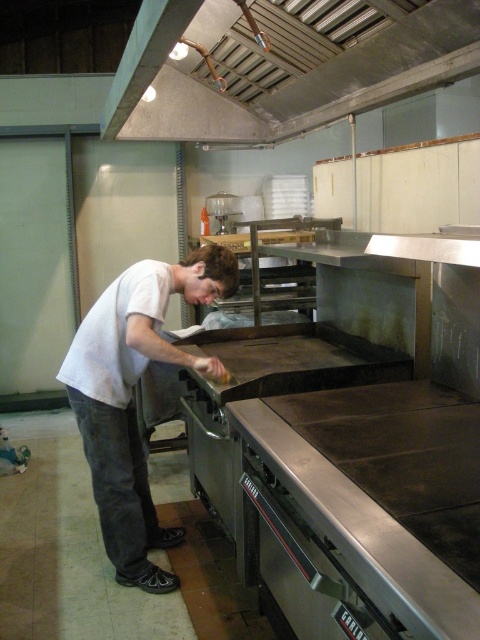
Is metallic at upper center bigger than white matte shirt at center?

Yes.

Is metallic at upper center in front of white matte shirt at center?

Yes.

Is point (252, 115) closer to viewer compared to point (83, 410)?

No, (252, 115) is further to viewer.

Locate an element on the screen. The height and width of the screenshot is (640, 480). metallic at upper center is located at coordinates (282, 65).